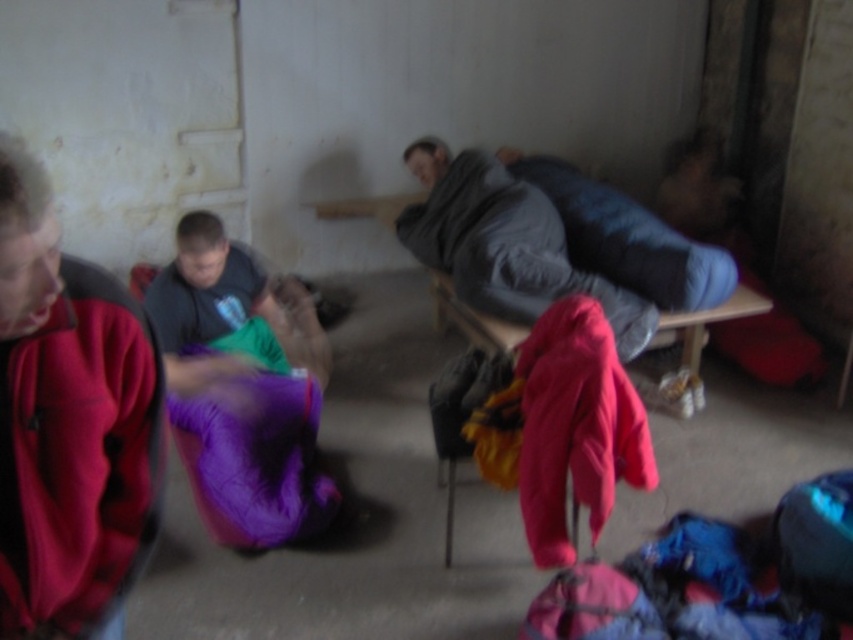
Is point (39, 394) in front of point (422, 259)?

Yes, point (39, 394) is in front of point (422, 259).

Locate an element on the screen. The width and height of the screenshot is (853, 640). red fleece jacket at left is located at coordinates (68, 419).